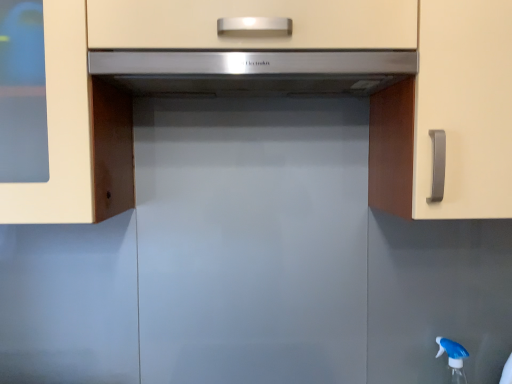
The height and width of the screenshot is (384, 512). What do you see at coordinates (290, 53) in the screenshot?
I see `matte white cabinet at center` at bounding box center [290, 53].

Where is `matte white cabinet at center`? This screenshot has height=384, width=512. matte white cabinet at center is located at coordinates (290, 53).

In the scene shown: From a real-world perspective, does matte white cabinet at center stand above blue translucent spray bottle at lower right?

Yes, from a real-world perspective, matte white cabinet at center is over blue translucent spray bottle at lower right

From the image's perspective, does matte white cabinet at center appear lower than blue translucent spray bottle at lower right?

No, from the image's perspective, matte white cabinet at center is not beneath blue translucent spray bottle at lower right.

Which of these two, matte white cabinet at center or blue translucent spray bottle at lower right, stands taller?

matte white cabinet at center is taller.

Locate an element on the screen. The width and height of the screenshot is (512, 384). faucet below the matte white cabinet at center (from a real-world perspective) is located at coordinates (453, 359).

From a real-world perspective, is blue translucent spray bottle at lower right over satin silver range hood at center?

Actually, blue translucent spray bottle at lower right is physically below satin silver range hood at center in the real world.

From the image's perspective, between blue translucent spray bottle at lower right and satin silver range hood at center, which one is located above?

satin silver range hood at center is shown above in the image.

Is blue translucent spray bottle at lower right oriented towards satin silver range hood at center?

No, blue translucent spray bottle at lower right is not facing towards satin silver range hood at center.

Does satin silver range hood at center turn towards matte white cabinet at center?

Yes.

From the image's perspective, is satin silver range hood at center above matte white cabinet at center?

Correct, satin silver range hood at center appears higher than matte white cabinet at center in the image.

Which of these two, satin silver range hood at center or matte white cabinet at center, stands taller?

Standing taller between the two is matte white cabinet at center.

Who is smaller, satin silver range hood at center or matte white cabinet at center?

With smaller size is satin silver range hood at center.

Is blue translucent spray bottle at lower right taller or shorter than matte white cabinet at center?

In the image, blue translucent spray bottle at lower right appears to be shorter than matte white cabinet at center.

Can you tell me how much blue translucent spray bottle at lower right and matte white cabinet at center differ in facing direction?

There is a 51.7-degree angle between the facing directions of blue translucent spray bottle at lower right and matte white cabinet at center.

From a real-world perspective, which is physically above, blue translucent spray bottle at lower right or matte white cabinet at center?

From a 3D spatial view, matte white cabinet at center is above.

Is matte white cabinet at center not within satin silver range hood at center?

matte white cabinet at center is positioned outside satin silver range hood at center.

How distant is matte white cabinet at center from satin silver range hood at center?

matte white cabinet at center is 5.19 inches from satin silver range hood at center.

Between matte white cabinet at center and satin silver range hood at center, which one is positioned in front?

matte white cabinet at center is in front.

Considering the sizes of objects matte white cabinet at center and satin silver range hood at center in the image provided, who is wider, matte white cabinet at center or satin silver range hood at center?

Wider between the two is matte white cabinet at center.

Where is `home appliance in front of the blue translucent spray bottle at lower right`? Image resolution: width=512 pixels, height=384 pixels. home appliance in front of the blue translucent spray bottle at lower right is located at coordinates (252, 71).

Based on their sizes in the image, would you say satin silver range hood at center is bigger or smaller than blue translucent spray bottle at lower right?

satin silver range hood at center is bigger than blue translucent spray bottle at lower right.

Is point (324, 72) closer to viewer compared to point (455, 346)?

Yes, it is.

Is satin silver range hood at center wider or thinner than blue translucent spray bottle at lower right?

satin silver range hood at center is wider than blue translucent spray bottle at lower right.

Where is `cabinetry on the left of blue translucent spray bottle at lower right`? The height and width of the screenshot is (384, 512). cabinetry on the left of blue translucent spray bottle at lower right is located at coordinates (290, 53).

Find the location of `home appliance positioned vertically above the blue translucent spray bottle at lower right (from a real-world perspective)`. home appliance positioned vertically above the blue translucent spray bottle at lower right (from a real-world perspective) is located at coordinates (252, 71).

From the picture: Which object lies nearer to the anchor point matte white cabinet at center, satin silver range hood at center or blue translucent spray bottle at lower right?

satin silver range hood at center is closer to matte white cabinet at center.

Which object lies nearer to the anchor point blue translucent spray bottle at lower right, matte white cabinet at center or satin silver range hood at center?

Among the two, matte white cabinet at center is located nearer to blue translucent spray bottle at lower right.

Based on their spatial positions, is matte white cabinet at center or blue translucent spray bottle at lower right closer to satin silver range hood at center?

Based on the image, matte white cabinet at center appears to be nearer to satin silver range hood at center.

Looking at the image, which one is located further to blue translucent spray bottle at lower right, satin silver range hood at center or matte white cabinet at center?

satin silver range hood at center.

Which object lies nearer to the anchor point matte white cabinet at center, blue translucent spray bottle at lower right or satin silver range hood at center?

satin silver range hood at center lies closer to matte white cabinet at center than the other object.

Estimate the real-world distances between objects in this image. Which object is further from satin silver range hood at center, blue translucent spray bottle at lower right or matte white cabinet at center?

blue translucent spray bottle at lower right.

Find the location of `cabinetry between satin silver range hood at center and blue translucent spray bottle at lower right vertically`. cabinetry between satin silver range hood at center and blue translucent spray bottle at lower right vertically is located at coordinates (290, 53).